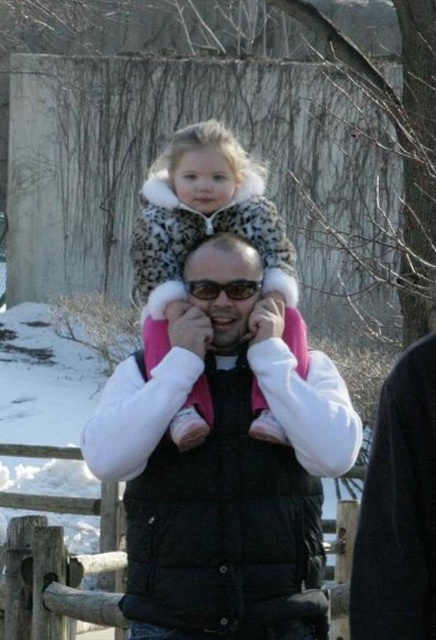
You are a fashion designer observing the winter scene. You notice the black puffy vest at center and the spotted fur coat at center. Which clothing item is shorter in length?

The black puffy vest at center is shorter than the spotted fur coat at center.

In the scene shown: You are a photographer trying to capture the scene with the black puffy vest at center and the spotted fur coat at center. Which object should you focus on first if you want to include both in your shot without moving the camera? Explain your reasoning based on their positions.

The black puffy vest at center is positioned on the right side of the spotted fur coat at center. Since they are both at the center but the black puffy vest is to the right, you should focus on the spotted fur coat at center first to ensure both are in frame without moving the camera.

In the scene shown: You are a photographer trying to capture a closeup of the black puffy vest at center and the spotted fur coat at center. Given that your camera can only focus on objects within 50 centimeters of each other, will both items be in focus?

The distance between the black puffy vest at center and spotted fur coat at center is 48.58 centimeters, which is within the 50 centimeter range. Therefore, both items will be in focus.